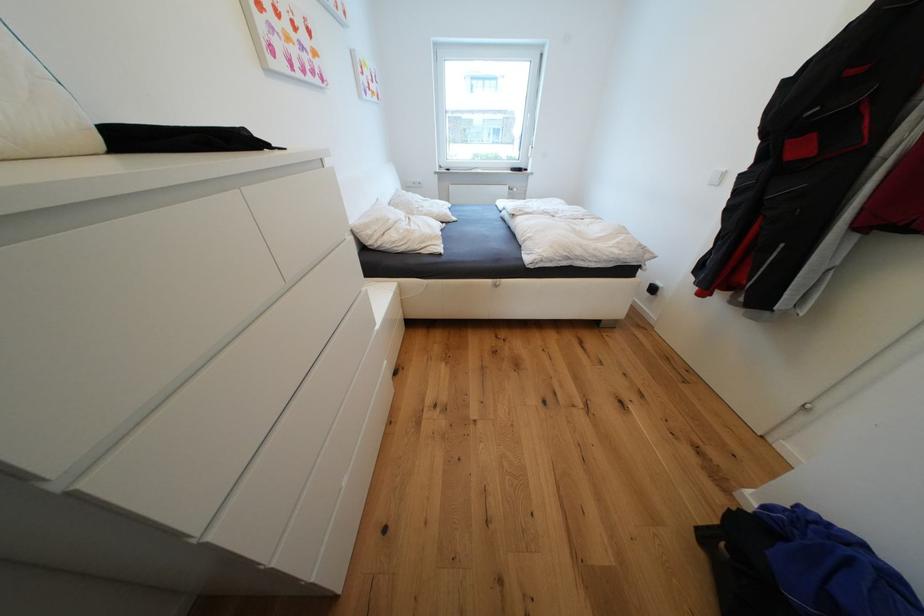
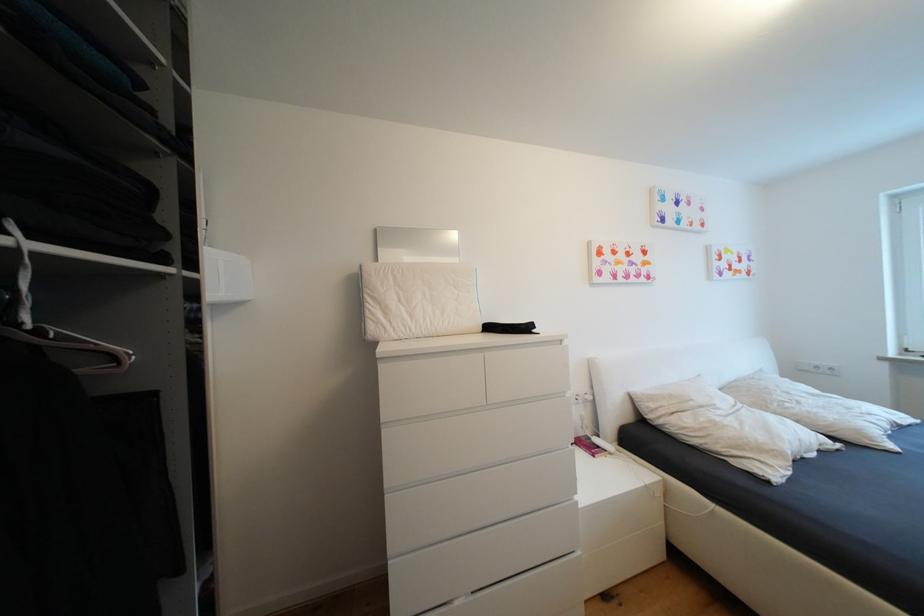
Question: The camera is either moving clockwise (left) or counter-clockwise (right) around the object. The first image is from the beginning of the video and the second image is from the end. Is the camera moving left or right when shooting the video?

Choices:
 (A) Left
 (B) Right

Answer: (B)